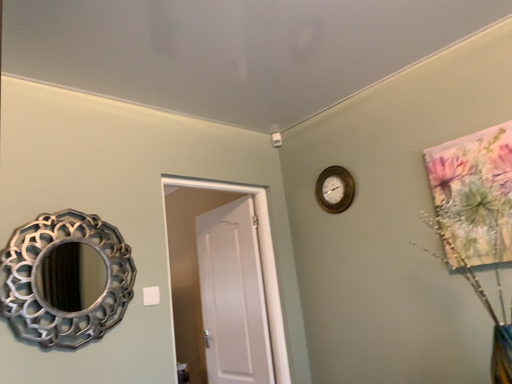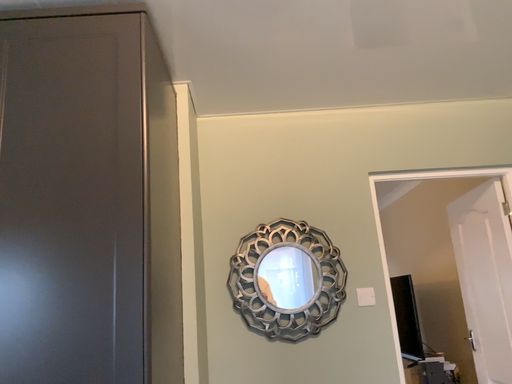
Question: How did the camera likely rotate when shooting the video?

Choices:
 (A) rotated upward
 (B) rotated downward

Answer: (B)